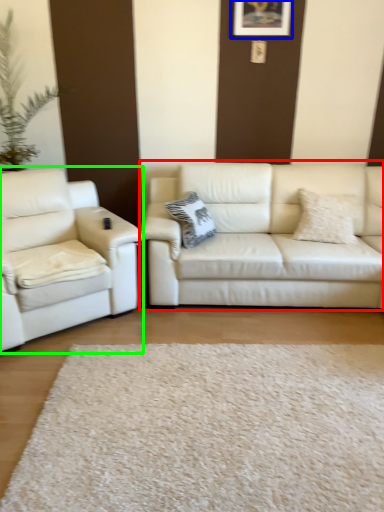
Question: Based on their relative distances, which object is nearer to studio couch (highlighted by a red box)? Choose from picture frame (highlighted by a blue box) and studio couch (highlighted by a green box).

Choices:
 (A) picture frame
 (B) studio couch

Answer: (B)